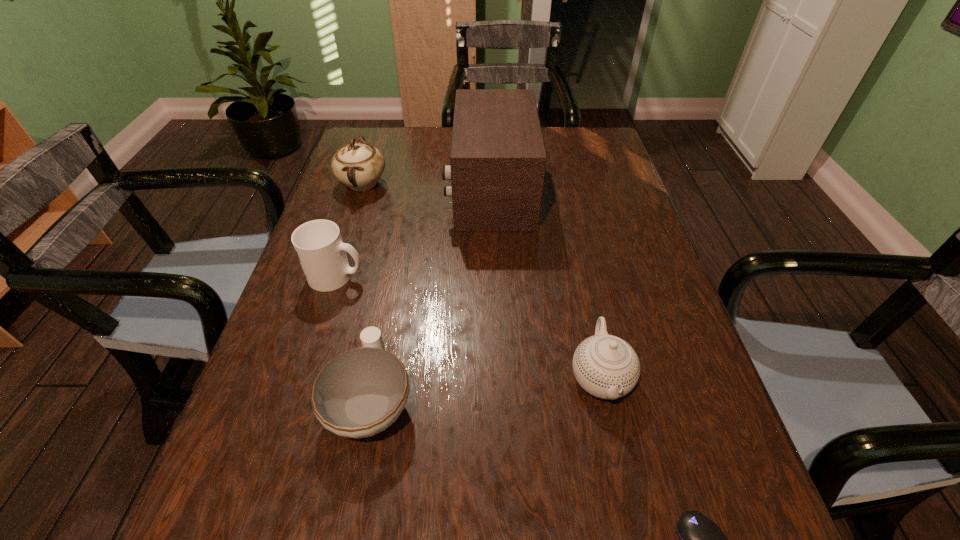
Where is `the fourth object from left to right`? the fourth object from left to right is located at coordinates (497, 167).

Locate an element on the screen. radio receiver is located at coordinates (497, 167).

The width and height of the screenshot is (960, 540). What are the coordinates of `the tallest chinaware` in the screenshot? It's located at (359, 166).

Locate an element on the screen. The height and width of the screenshot is (540, 960). mug is located at coordinates (318, 244).

Locate an element on the screen. The width and height of the screenshot is (960, 540). the rightmost chinaware is located at coordinates (605, 366).

This screenshot has height=540, width=960. Find the location of `the second tallest chinaware`. the second tallest chinaware is located at coordinates (605, 366).

Identify the location of the fifth tallest object. The image size is (960, 540). (361, 392).

You are a GUI agent. You are given a task and a screenshot of the screen. Output one action in this format:
    pyautogui.click(x=<x>, y=<y>)
    Task: Click on the vacant space located on the front-facing side of the radio receiver
    This screenshot has width=960, height=540.
    Given the screenshot: What is the action you would take?
    pyautogui.click(x=363, y=191)

You are a GUI agent. You are given a task and a screenshot of the screen. Output one action in this format:
    pyautogui.click(x=<x>, y=<y>)
    Task: Click on the blank area located 0.180m on the front-facing side of the radio receiver
    The image size is (960, 540).
    Given the screenshot: What is the action you would take?
    pyautogui.click(x=384, y=191)

You are a GUI agent. You are given a task and a screenshot of the screen. Output one action in this format:
    pyautogui.click(x=<x>, y=<y>)
    Task: Click on the free region located on the front-facing side of the radio receiver
    Image resolution: width=960 pixels, height=540 pixels.
    Given the screenshot: What is the action you would take?
    pyautogui.click(x=398, y=191)